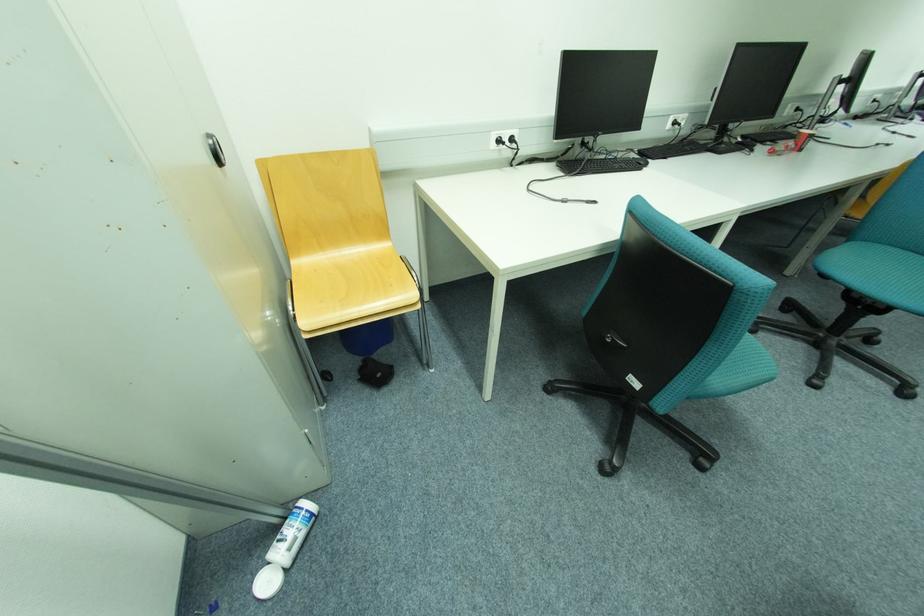
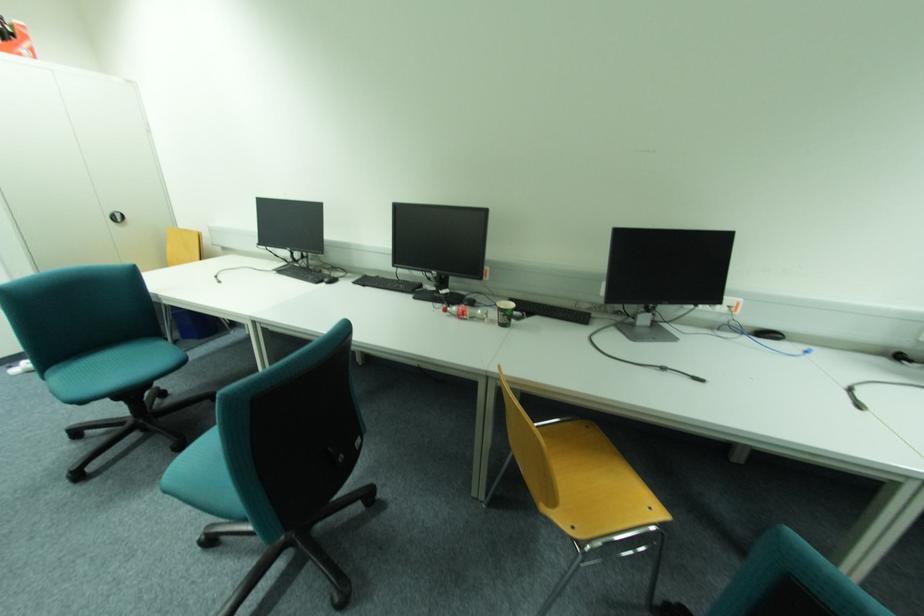
In the second image, find the point that corresponds to (x=779, y=151) in the first image.

(451, 310)